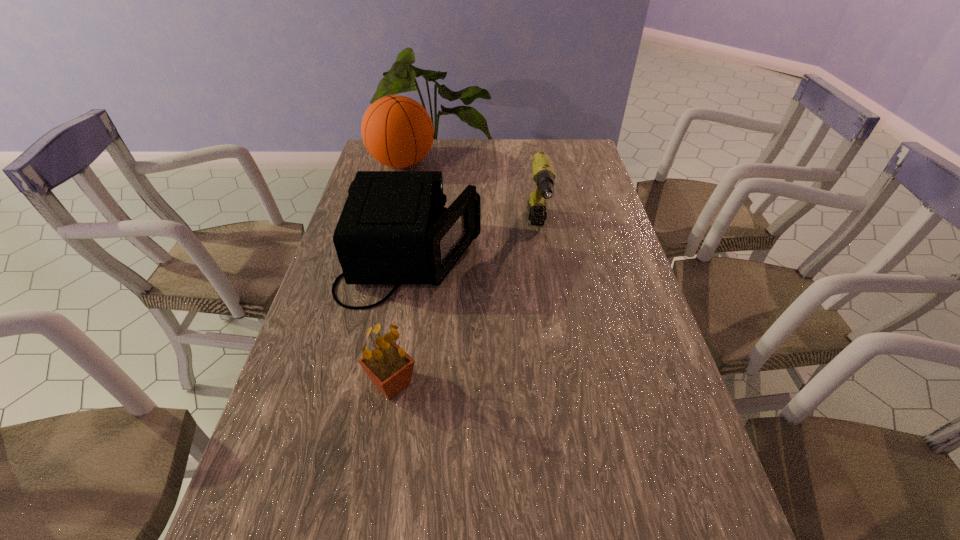
This screenshot has width=960, height=540. I want to click on vacant space that satisfies the following two spatial constraints: 1. on the handle side of the rightmost object; 2. at the front of the nearest object with flowers visible, so click(x=562, y=384).

This screenshot has height=540, width=960. I want to click on vacant point that satisfies the following two spatial constraints: 1. on the handle side of the drill; 2. at the front of the sunflower with flowers visible, so click(562, 384).